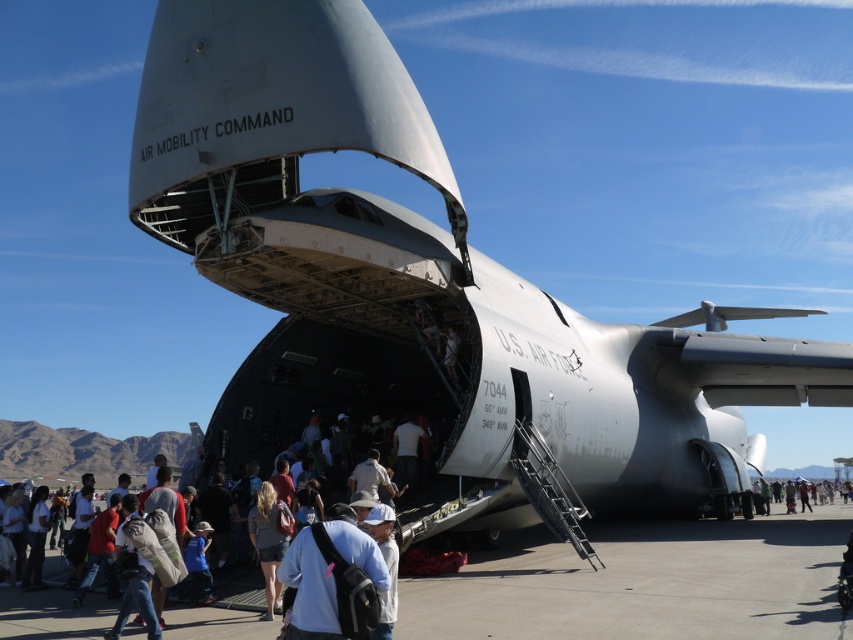
Question: Can you confirm if gray concrete tarmac at lower center is smaller than light blue fabric shirt at lower center?

Choices:
 (A) no
 (B) yes

Answer: (A)

Question: In this image, where is gray concrete tarmac at lower center located relative to light blue fabric shirt at lower center?

Choices:
 (A) above
 (B) below

Answer: (B)

Question: Considering the real-world distances, which object is farthest from the gray concrete tarmac at lower center?

Choices:
 (A) light blue fabric shirt at lower center
 (B) white fabric crowd at center

Answer: (B)

Question: Can you confirm if gray concrete tarmac at lower center is thinner than light blue fabric shirt at lower center?

Choices:
 (A) no
 (B) yes

Answer: (A)

Question: Considering the real-world distances, which object is farthest from the white fabric crowd at center?

Choices:
 (A) light blue fabric shirt at lower center
 (B) white cotton shirt at lower right
 (C) gray concrete tarmac at lower center

Answer: (B)

Question: Which object is the closest to the light blue fabric shirt at lower center?

Choices:
 (A) gray concrete tarmac at lower center
 (B) white fabric crowd at center
 (C) white cotton shirt at lower right

Answer: (A)